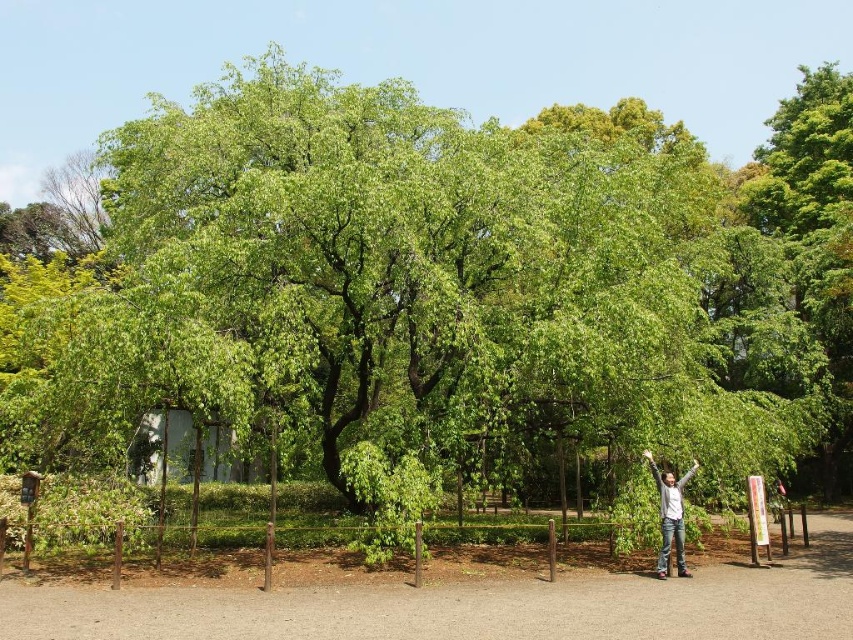
Question: Considering the relative positions of brown soil at lower center and white wood hut at lower left in the image provided, where is brown soil at lower center located with respect to white wood hut at lower left?

Choices:
 (A) left
 (B) right

Answer: (B)

Question: Which point is closer to the camera taking this photo?

Choices:
 (A) (662, 525)
 (B) (201, 460)

Answer: (A)

Question: Which point is farther to the camera?

Choices:
 (A) white wood hut at lower left
 (B) gray cotton shirt at center
 (C) brown soil at lower center

Answer: (A)

Question: Does brown soil at lower center have a smaller size compared to gray cotton shirt at center?

Choices:
 (A) yes
 (B) no

Answer: (B)

Question: Is the position of white wood hut at lower left less distant than that of gray cotton shirt at center?

Choices:
 (A) yes
 (B) no

Answer: (B)

Question: Which of the following is the farthest from the observer?

Choices:
 (A) gray cotton shirt at center
 (B) brown soil at lower center
 (C) white wood hut at lower left

Answer: (C)